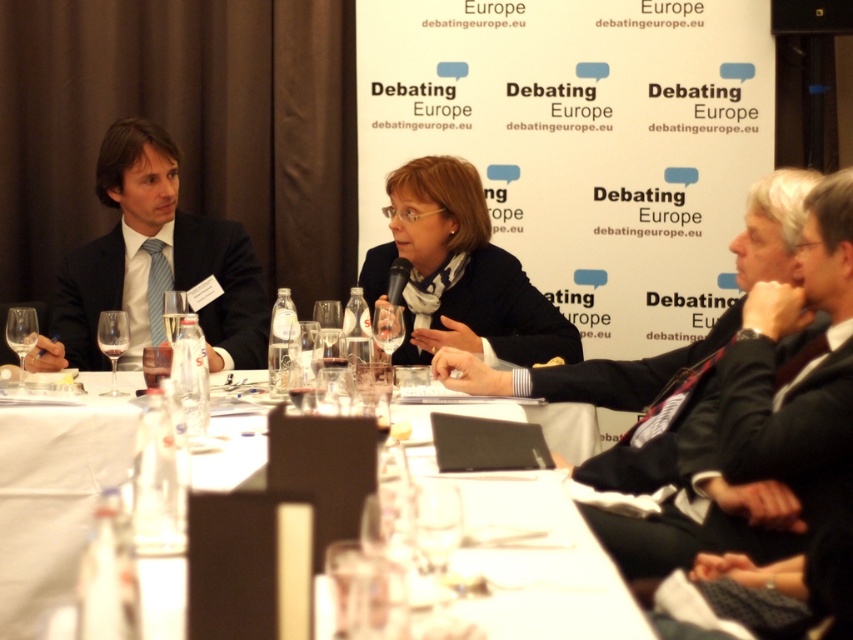
Question: Is dark gray suit at center positioned behind matte black suit at left?

Choices:
 (A) no
 (B) yes

Answer: (A)

Question: Which object appears closest to the camera in this image?

Choices:
 (A) dark gray suit at center
 (B) matte black suit at left

Answer: (A)

Question: Which point is closer to the camera?

Choices:
 (A) matte black suit at left
 (B) matte black jacket at center
 (C) white glossy table at center
 (D) dark gray suit at center

Answer: (C)

Question: Which point is closer to the camera?

Choices:
 (A) matte black jacket at center
 (B) matte black suit at left
 (C) white glossy table at center

Answer: (C)

Question: Can you confirm if white glossy table at center is positioned above matte black suit at left?

Choices:
 (A) yes
 (B) no

Answer: (B)

Question: Is white glossy table at center above matte black suit at left?

Choices:
 (A) no
 (B) yes

Answer: (A)